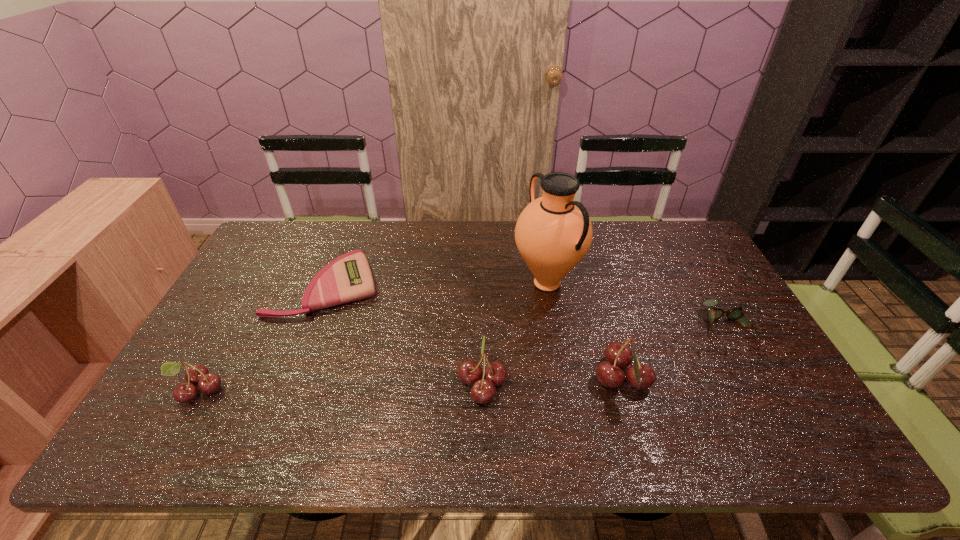
Locate an element on the screen. The image size is (960, 540). vacant space in between the second shortest cherry and the tallest object is located at coordinates (515, 333).

Locate an element on the screen. vacant area that lies between the second shortest object and the pitcher is located at coordinates (637, 306).

Where is `vacant space that is in between the third tallest object and the tallest object`? vacant space that is in between the third tallest object and the tallest object is located at coordinates (515, 333).

At what (x,y) coordinates should I click in order to perform the action: click on empty space between the third shortest object and the spectacles. Please return your answer as a coordinate pair (x, y). Looking at the image, I should click on (463, 360).

Locate an element on the screen. The height and width of the screenshot is (540, 960). unoccupied area between the tallest object and the second shortest object is located at coordinates (637, 306).

Where is `free spot between the pitcher and the third shortest object`? The width and height of the screenshot is (960, 540). free spot between the pitcher and the third shortest object is located at coordinates (372, 336).

This screenshot has width=960, height=540. What are the coordinates of `free space between the second tallest cherry and the shortest cherry` in the screenshot? It's located at (340, 386).

At what (x,y) coordinates should I click in order to perform the action: click on free space between the shortest object and the tallest object. Please return your answer as a coordinate pair (x, y). The width and height of the screenshot is (960, 540). Looking at the image, I should click on (437, 285).

Where is `free space between the shortest object and the rightmost cherry`? free space between the shortest object and the rightmost cherry is located at coordinates (474, 333).

Locate an element on the screen. object that ranks as the fifth closest to the rightmost cherry is located at coordinates (197, 374).